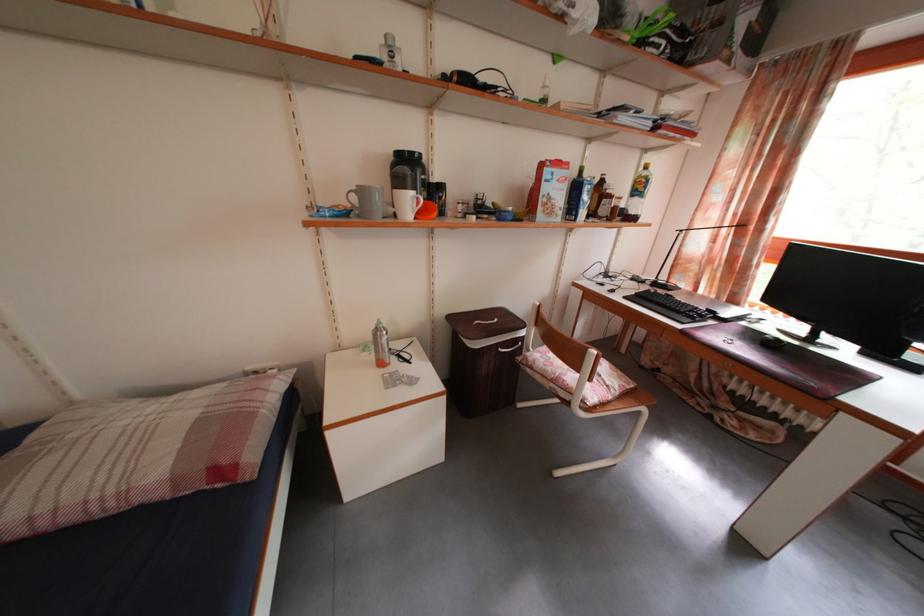
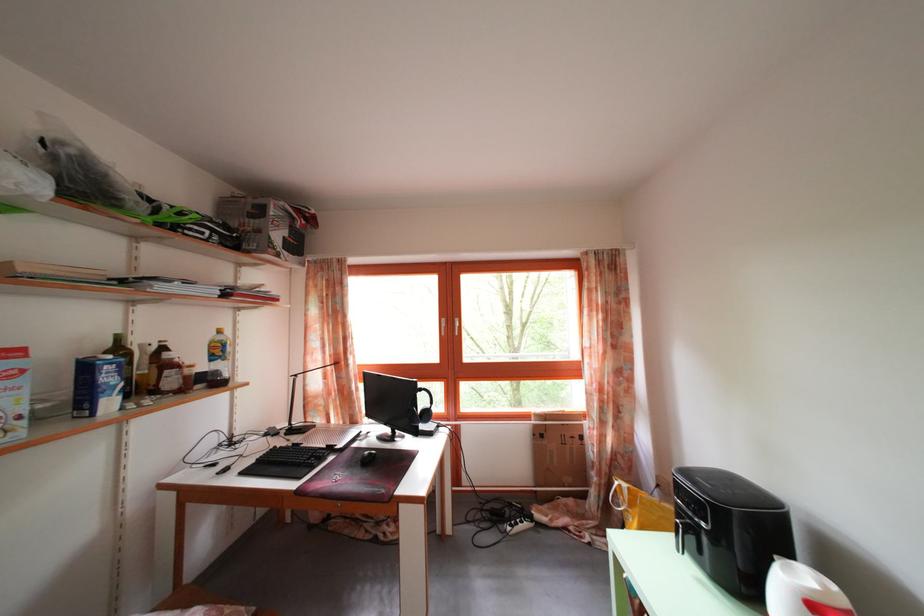
In the second image, find the point that corresponds to point 589,177 in the first image.

(126, 346)